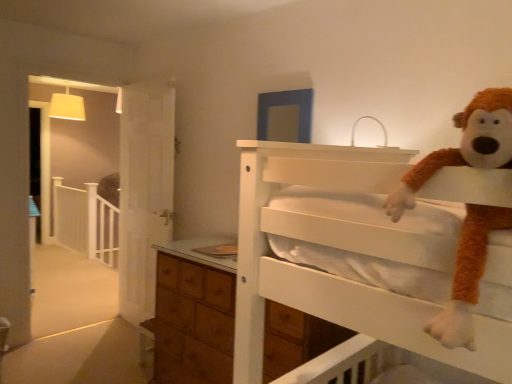
Question: From a real-world perspective, is white wooden balustrade at left physically located above or below brown furry monkey at upper right?

Choices:
 (A) above
 (B) below

Answer: (B)

Question: In the image, is white wooden balustrade at left positioned in front of or behind brown furry monkey at upper right?

Choices:
 (A) behind
 (B) front

Answer: (A)

Question: Considering the positions of point (66, 185) and point (477, 251), is point (66, 185) closer or farther from the camera than point (477, 251)?

Choices:
 (A) farther
 (B) closer

Answer: (A)

Question: In terms of size, does brown furry monkey at upper right appear bigger or smaller than white wooden balustrade at left?

Choices:
 (A) small
 (B) big

Answer: (A)

Question: From a real-world perspective, is brown furry monkey at upper right physically located above or below white wooden balustrade at left?

Choices:
 (A) below
 (B) above

Answer: (B)

Question: Is brown furry monkey at upper right in front of or behind white wooden balustrade at left in the image?

Choices:
 (A) front
 (B) behind

Answer: (A)

Question: From their relative heights in the image, would you say brown furry monkey at upper right is taller or shorter than white wooden balustrade at left?

Choices:
 (A) short
 (B) tall

Answer: (A)